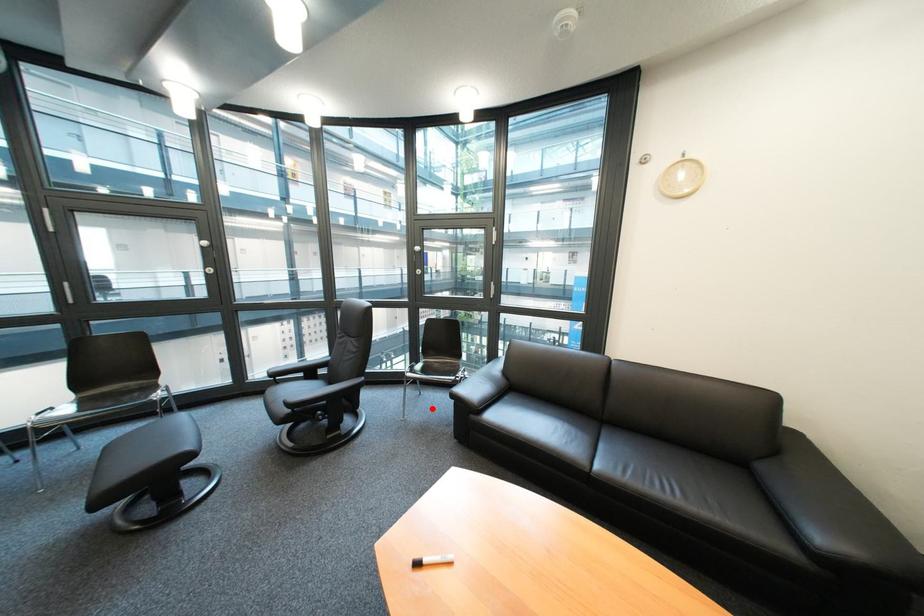
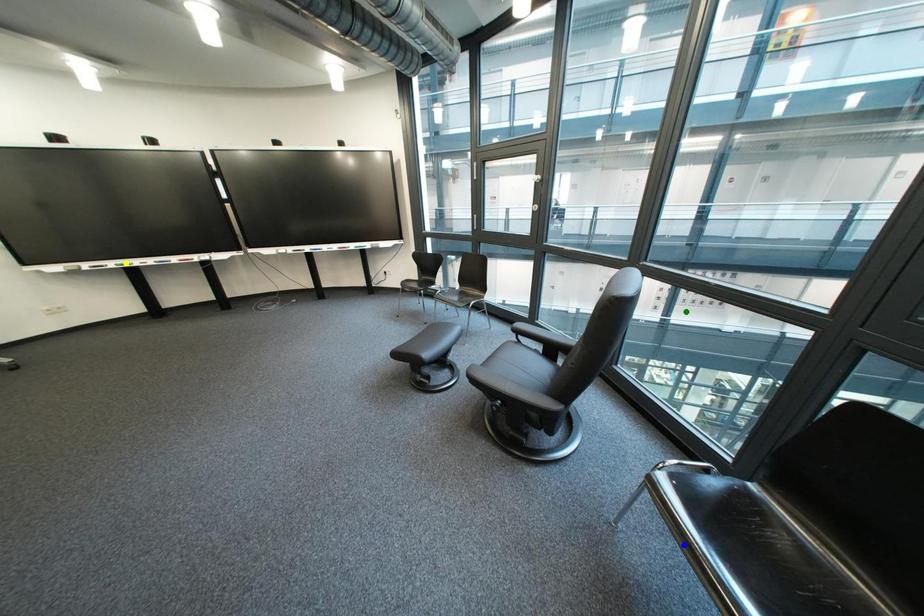
Question: I am providing you with two images of the same scene from different viewpoints. A red point is marked on the first image. You are given multiple points on the second image. In image 2, which mark is for the same physical point as the one in image 1?

Choices:
 (A) yellow point
 (B) blue point
 (C) green point

Answer: (B)